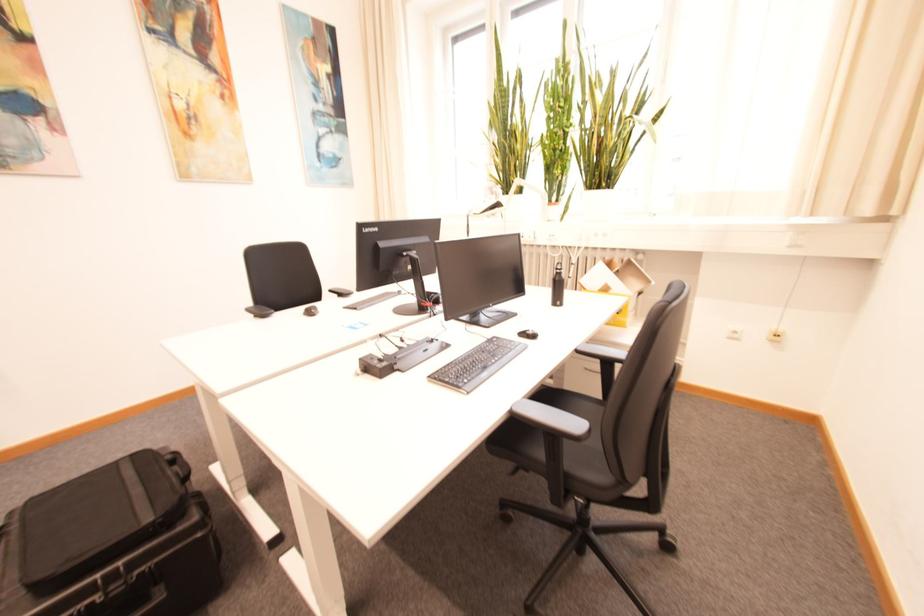
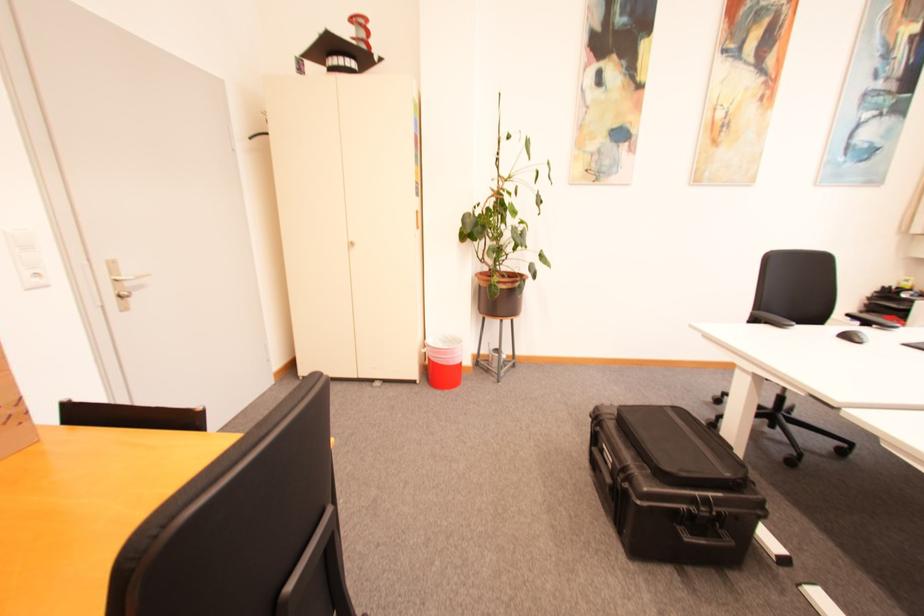
Locate, in the second image, the point that corresponds to the point at 254,310 in the first image.

(759, 315)